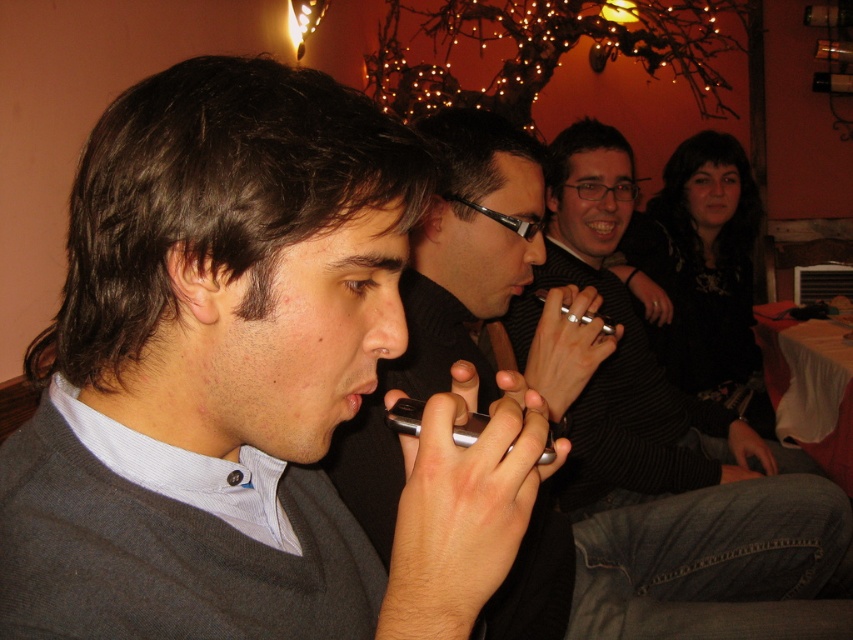
Is point (553, 525) positioned behind point (407, 429)?

Yes.

Does metallic silver phone at center appear over silver metallic smartphone at center?

No.

Which is in front, point (465, 128) or point (415, 408)?

Positioned in front is point (415, 408).

At what (x,y) coordinates should I click in order to perform the action: click on metallic silver phone at center. Please return your answer as a coordinate pair (x, y). Image resolution: width=853 pixels, height=640 pixels. Looking at the image, I should click on (682, 566).

Which is above, metallic silver phone at center or black textured sweater at center?

Positioned higher is black textured sweater at center.

Who is taller, metallic silver phone at center or black textured sweater at center?

Standing taller between the two is black textured sweater at center.

What do you see at coordinates (682, 566) in the screenshot?
I see `metallic silver phone at center` at bounding box center [682, 566].

What are the coordinates of `metallic silver phone at center` in the screenshot? It's located at (682, 566).

Who is shorter, gray matte sweater at center or silver metallic smartphone at center?

silver metallic smartphone at center is shorter.

Does point (83, 321) come behind point (469, 419)?

That is False.

Identify the location of gray matte sweater at center. The image size is (853, 640). (234, 253).